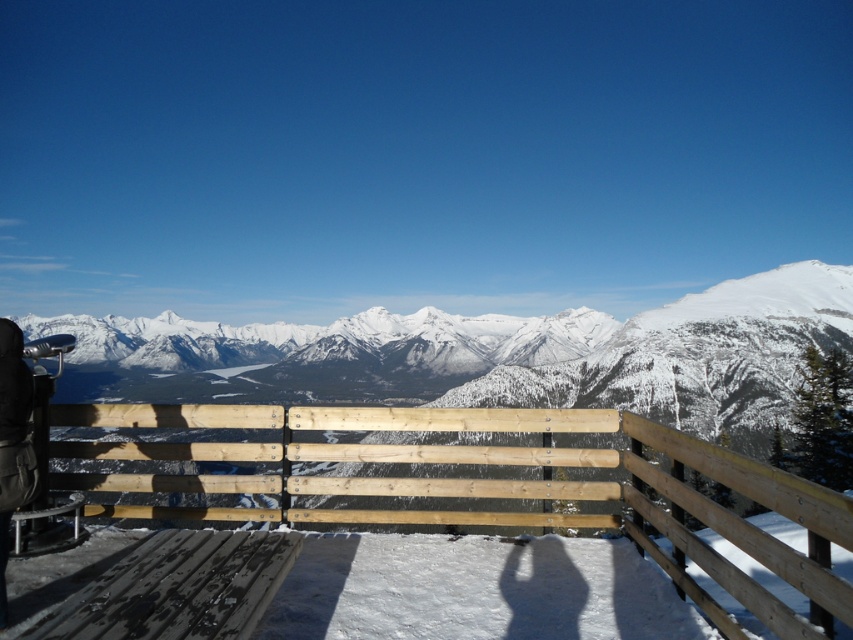
You are standing on the wooden observation deck and want to place your black leather jacket at left on the light brown wood at center. Based on their sizes, will the jacket fit entirely on the surface?

The light brown wood at center might be wider than black leather jacket at left, so there is a possibility that the jacket can fit entirely on the surface.

You are standing on the wooden observation deck and want to determine which of the two points, point (595, 465) or point (9, 356), is closer to you. Based on the scene description, which point is nearer?

Point (595, 465) is further to the viewer than point (9, 356). Wait, the question asks which is closer. So the answer should be point (9, 356) is closer because it is less further. Hmm, need to check the description again. The Objects Description says point A is further than point B. So point B is closer. Therefore, the answer is point (9, 356) is closer.

You are standing on the wooden observation deck and want to place a 1.5 meter long wooden bench on the deck. The bench must be placed between the light brown wood at center and the black leather jacket at left. Is there enough space between them to fit the bench?

The distance between the light brown wood at center and the black leather jacket at left is 10.30 meters, which is more than enough to fit a 1.5 meter long bench between them.